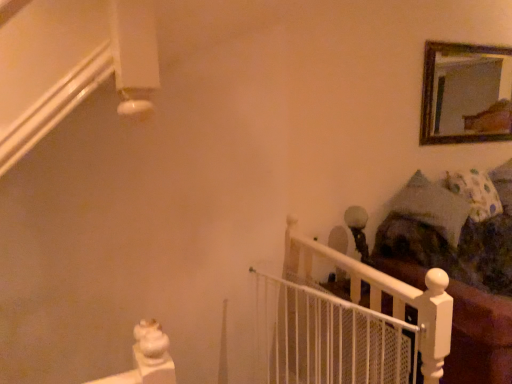
The image size is (512, 384). Describe the element at coordinates (475, 193) in the screenshot. I see `fluffy white pillow at right` at that location.

In order to face wooden-framed mirror at upper right, should I rotate leftwards or rightwards?

Rotate right and turn 27.259 degrees.

You are a GUI agent. You are given a task and a screenshot of the screen. Output one action in this format:
    pyautogui.click(x=<x>, y=<y>)
    Task: Click on the fluffy white pillow at right
    The width and height of the screenshot is (512, 384).
    Given the screenshot: What is the action you would take?
    pyautogui.click(x=475, y=193)

How different are the orientations of fluffy white pillow at right and white mesh gate at center in degrees?

The facing directions of fluffy white pillow at right and white mesh gate at center are 81.9 degrees apart.

Considering the relative sizes of fluffy white pillow at right and white mesh gate at center in the image provided, is fluffy white pillow at right shorter than white mesh gate at center?

Indeed, fluffy white pillow at right has a lesser height compared to white mesh gate at center.

Could you tell me if fluffy white pillow at right is turned towards white mesh gate at center?

No.

Is point (482, 185) closer to camera compared to point (278, 283)?

No, (482, 185) is further to viewer.

From the image's perspective, which is below, wooden-framed mirror at upper right or fluffy white pillow at right?

fluffy white pillow at right is shown below in the image.

How much distance is there between wooden-framed mirror at upper right and fluffy white pillow at right?

A distance of 2.09 meters exists between wooden-framed mirror at upper right and fluffy white pillow at right.

Is point (438, 53) positioned in front of point (470, 206)?

Yes, it is.

Is wooden-framed mirror at upper right not near fluffy white pillow at right?

Yes, wooden-framed mirror at upper right and fluffy white pillow at right are quite far apart.

Based on their positions, is white mesh gate at center located to the left or right of dark brown fabric bed at right?

Clearly, white mesh gate at center is on the left of dark brown fabric bed at right in the image.

Based on the photo, which of these two, white mesh gate at center or dark brown fabric bed at right, is thinner?

white mesh gate at center.

From the image's perspective, is white mesh gate at center located beneath dark brown fabric bed at right?

Correct, white mesh gate at center appears lower than dark brown fabric bed at right in the image.

Measure the distance from white mesh gate at center to dark brown fabric bed at right.

white mesh gate at center and dark brown fabric bed at right are 31.24 inches apart from each other.

From the image's perspective, is dark brown fabric bed at right positioned above or below fluffy white pillow at right?

Clearly, from the image's perspective, dark brown fabric bed at right is below fluffy white pillow at right.

Which of these two, dark brown fabric bed at right or fluffy white pillow at right, stands taller?

With more height is dark brown fabric bed at right.

Would you say dark brown fabric bed at right is inside or outside fluffy white pillow at right?

dark brown fabric bed at right is not inside fluffy white pillow at right, it's outside.

Which is behind, point (456, 281) or point (473, 189)?

The point (473, 189) is farther from the camera.

Considering the sizes of objects white mesh gate at center and fluffy white pillow at right in the image provided, who is smaller, white mesh gate at center or fluffy white pillow at right?

white mesh gate at center is smaller.

Considering the relative positions of white mesh gate at center and fluffy white pillow at right in the image provided, is white mesh gate at center behind fluffy white pillow at right?

No, the depth of white mesh gate at center is less than that of fluffy white pillow at right.

Could you tell me if white mesh gate at center is facing fluffy white pillow at right?

No, white mesh gate at center does not turn towards fluffy white pillow at right.

Does point (321, 357) appear closer or farther from the camera than point (479, 184)?

Point (321, 357) appears to be closer to the viewer than point (479, 184).

Between fluffy white pillow at right and wooden-framed mirror at upper right, which one appears on the left side from the viewer's perspective?

wooden-framed mirror at upper right is more to the left.

In the scene shown: Who is bigger, fluffy white pillow at right or wooden-framed mirror at upper right?

fluffy white pillow at right is bigger.

Consider the image. Is fluffy white pillow at right beside wooden-framed mirror at upper right?

fluffy white pillow at right and wooden-framed mirror at upper right are clearly separated.

At what (x,y) coordinates should I click in order to perform the action: click on picture frame to the left of fluffy white pillow at right. Please return your answer as a coordinate pair (x, y). Image resolution: width=512 pixels, height=384 pixels. Looking at the image, I should click on (464, 94).

Considering the points (261, 316) and (446, 55), which point is behind, point (261, 316) or point (446, 55)?

The point (446, 55) is farther.

Considering the relative positions of white mesh gate at center and wooden-framed mirror at upper right in the image provided, is white mesh gate at center to the right of wooden-framed mirror at upper right from the viewer's perspective?

No.

Would you say wooden-framed mirror at upper right is part of white mesh gate at center's contents?

No, wooden-framed mirror at upper right is not inside white mesh gate at center.

Between white mesh gate at center and wooden-framed mirror at upper right, which one has more height?

white mesh gate at center is taller.

Find the location of a particular element. balustrade on the left of fluffy white pillow at right is located at coordinates (330, 339).

Find the location of a particular element. This screenshot has width=512, height=384. pillow that appears below the wooden-framed mirror at upper right (from the image's perspective) is located at coordinates (475, 193).

When comparing their distances from dark brown fabric bed at right, does fluffy white pillow at right or white mesh gate at center seem closer?

Among the two, fluffy white pillow at right is located nearer to dark brown fabric bed at right.

Estimate the real-world distances between objects in this image. Which object is further from white mesh gate at center, fluffy white pillow at right or dark brown fabric bed at right?

fluffy white pillow at right is positioned further to the anchor white mesh gate at center.

Estimate the real-world distances between objects in this image. Which object is closer to dark brown fabric bed at right, wooden-framed mirror at upper right or fluffy white pillow at right?

fluffy white pillow at right.

Estimate the real-world distances between objects in this image. Which object is closer to fluffy white pillow at right, white mesh gate at center or wooden-framed mirror at upper right?

The object closer to fluffy white pillow at right is white mesh gate at center.

Looking at this image, from the image, which object appears to be farther from dark brown fabric bed at right, fluffy white pillow at right or wooden-framed mirror at upper right?

wooden-framed mirror at upper right is positioned further to the anchor dark brown fabric bed at right.

Estimate the real-world distances between objects in this image. Which object is further from wooden-framed mirror at upper right, white mesh gate at center or dark brown fabric bed at right?

white mesh gate at center lies further to wooden-framed mirror at upper right than the other object.

When comparing their distances from dark brown fabric bed at right, does white mesh gate at center or fluffy white pillow at right seem closer?

fluffy white pillow at right lies closer to dark brown fabric bed at right than the other object.

Looking at the image, which one is located closer to wooden-framed mirror at upper right, white mesh gate at center or fluffy white pillow at right?

fluffy white pillow at right is positioned closer to the anchor wooden-framed mirror at upper right.

Where is `pillow situated between white mesh gate at center and dark brown fabric bed at right from left to right`? pillow situated between white mesh gate at center and dark brown fabric bed at right from left to right is located at coordinates (475, 193).

At what (x,y) coordinates should I click in order to perform the action: click on bed between wooden-framed mirror at upper right and white mesh gate at center in the up-down direction. Please return your answer as a coordinate pair (x, y). Looking at the image, I should click on (462, 281).

Locate an element on the screen. pillow between wooden-framed mirror at upper right and dark brown fabric bed at right in the vertical direction is located at coordinates (475, 193).

Identify the location of pillow between wooden-framed mirror at upper right and white mesh gate at center vertically. (475, 193).